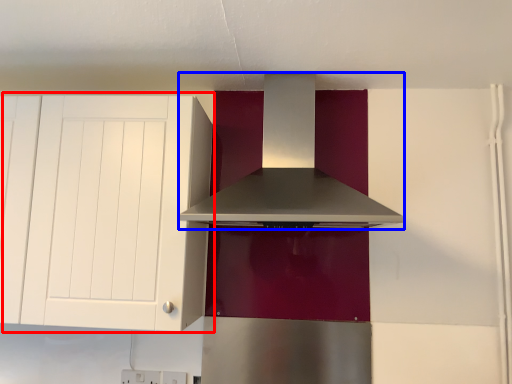
Question: Among these objects, which one is farthest to the camera, cabinetry (highlighted by a red box) or home appliance (highlighted by a blue box)?

Choices:
 (A) cabinetry
 (B) home appliance

Answer: (A)